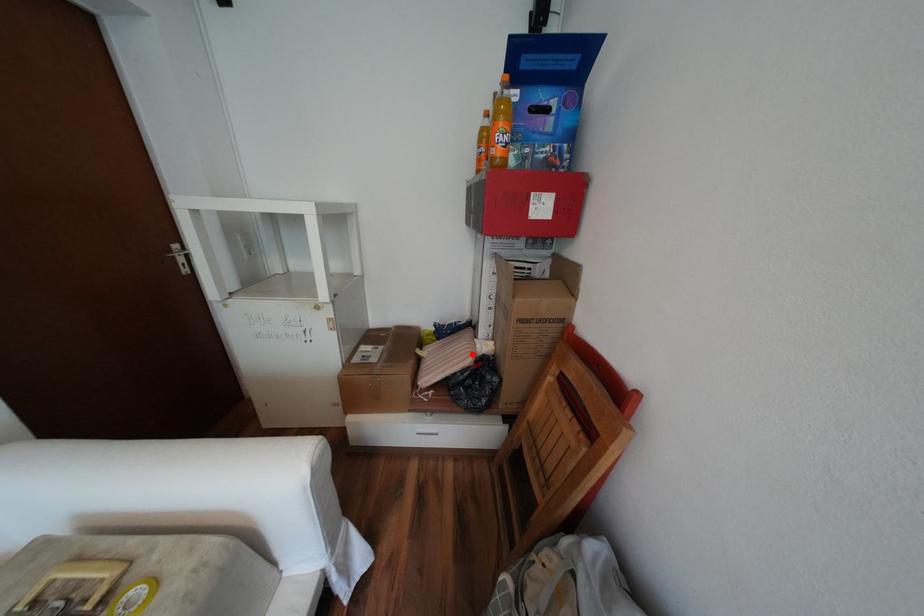
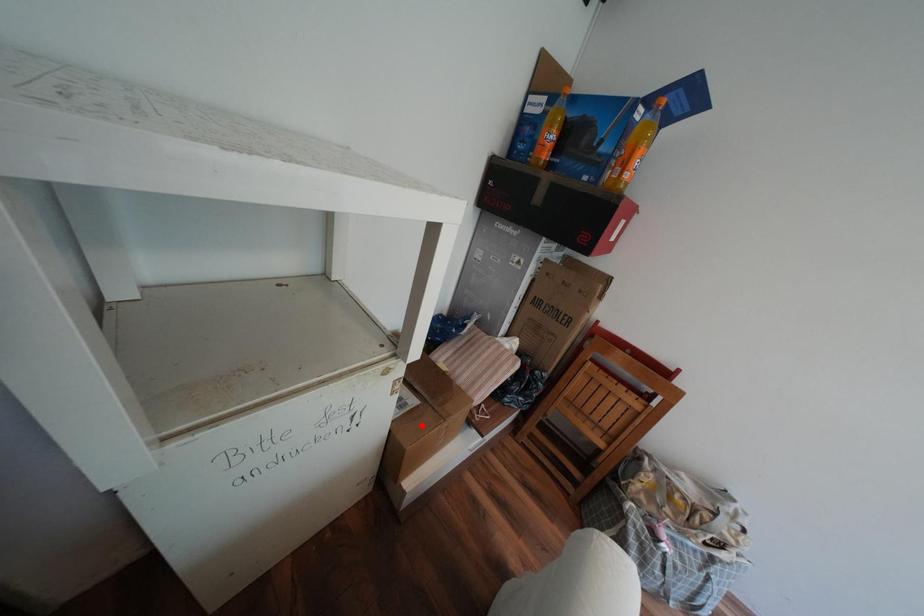
I am providing you with two images of the same scene from different viewpoints. A red point is marked on the first image and another point is marked on the second image. Is the red point in image1 aligned with the point shown in image2?

No